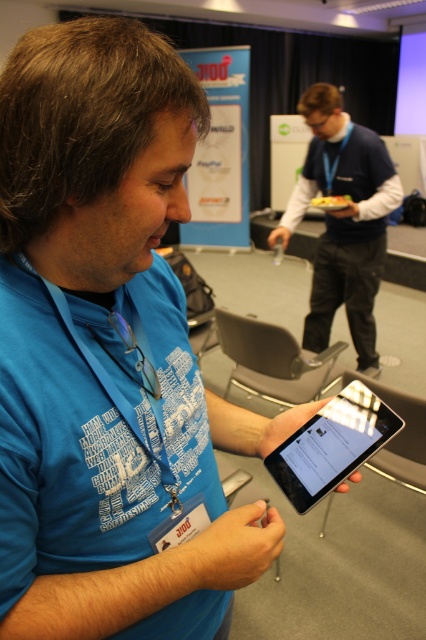
Does blue fabric shirt at center have a lesser width compared to black glossy tablet at center?

No, blue fabric shirt at center is not thinner than black glossy tablet at center.

Can you confirm if blue fabric shirt at center is positioned to the left of black glossy tablet at center?

In fact, blue fabric shirt at center is to the right of black glossy tablet at center.

You are a GUI agent. You are given a task and a screenshot of the screen. Output one action in this format:
    pyautogui.click(x=<x>, y=<y>)
    Task: Click on the blue fabric shirt at center
    The height and width of the screenshot is (640, 426).
    Given the screenshot: What is the action you would take?
    pyautogui.click(x=342, y=220)

Find the location of a particular element. blue fabric shirt at center is located at coordinates (342, 220).